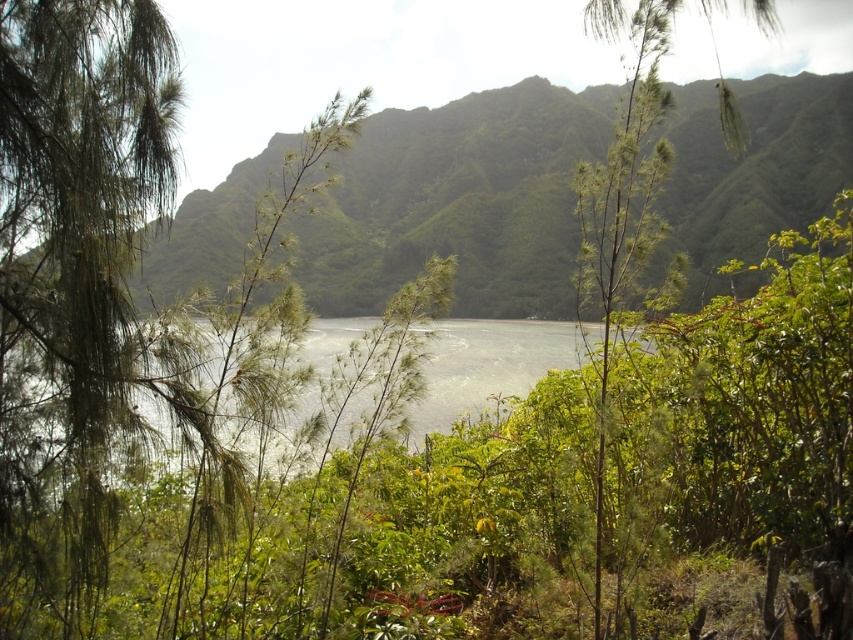
Between point (500, 284) and point (602, 211), which one is positioned behind?

The point (500, 284) is more distant.

What do you see at coordinates (459, 202) in the screenshot? Image resolution: width=853 pixels, height=640 pixels. I see `green leafy hillside at upper center` at bounding box center [459, 202].

Locate an element on the screen. Image resolution: width=853 pixels, height=640 pixels. green leafy hillside at upper center is located at coordinates (459, 202).

At what (x,y) coordinates should I click in order to perform the action: click on green leafy hillside at upper center. Please return your answer as a coordinate pair (x, y). The height and width of the screenshot is (640, 853). Looking at the image, I should click on (459, 202).

Can you confirm if green leafy tree at center is thinner than clear water at center?

In fact, green leafy tree at center might be wider than clear water at center.

Is point (645, 204) farther from viewer compared to point (465, 337)?

No, (645, 204) is in front of (465, 337).

Find the location of `green leafy tree at center`. green leafy tree at center is located at coordinates (622, 196).

Who is lower down, green leafy hillside at upper center or clear water at center?

clear water at center is lower down.

Can you confirm if green leafy hillside at upper center is shorter than clear water at center?

In fact, green leafy hillside at upper center may be taller than clear water at center.

Is point (730, 209) closer to viewer compared to point (485, 358)?

No, (730, 209) is behind (485, 358).

Identify the location of green leafy hillside at upper center. pos(459,202).